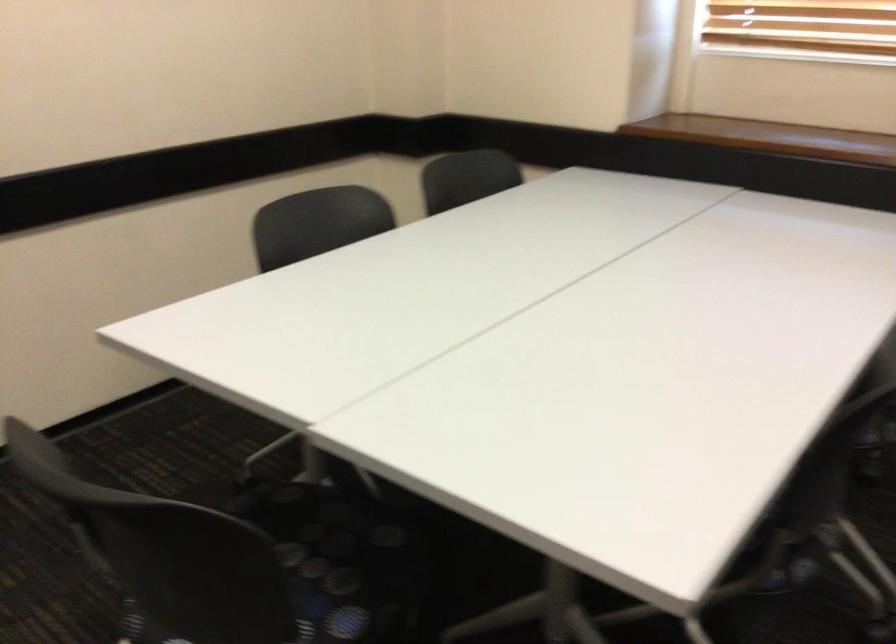
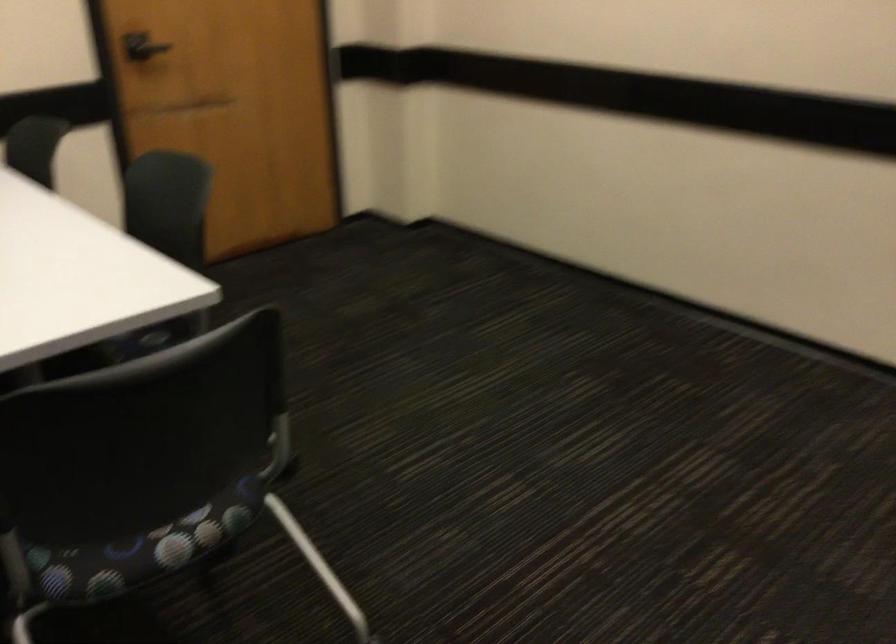
How did the camera likely rotate?

The camera's rotation is toward left-down.